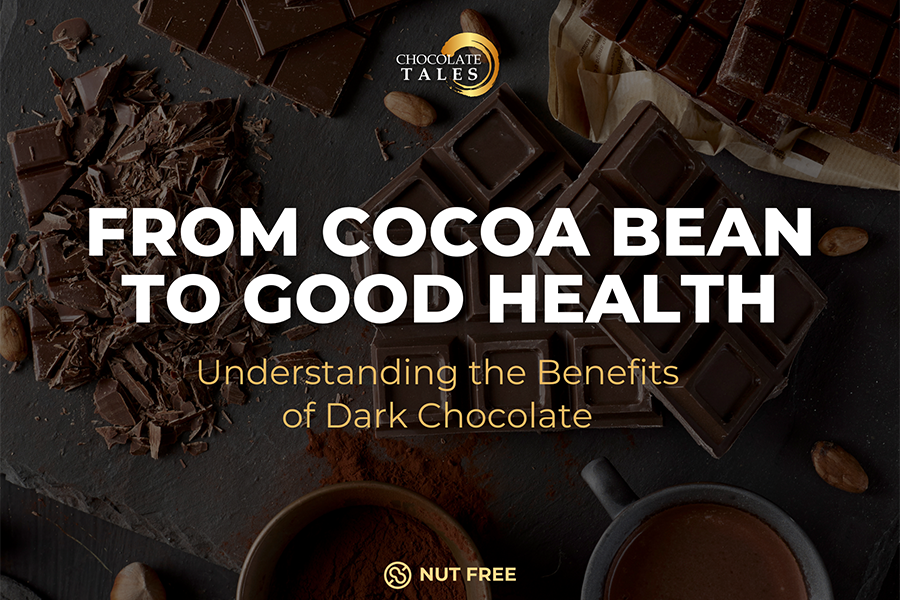
Where is `mug  handle`? mug  handle is located at coordinates (594, 486).